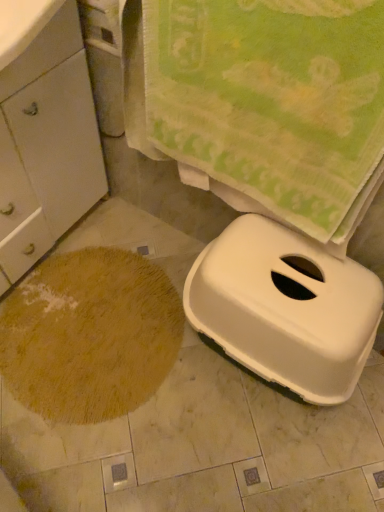
You are a GUI agent. You are given a task and a screenshot of the screen. Output one action in this format:
    pyautogui.click(x=<x>, y=<y>)
    Task: Click on the free point to the right of brown shaggy rug at lower left
    The height and width of the screenshot is (512, 384).
    Given the screenshot: What is the action you would take?
    pyautogui.click(x=229, y=411)